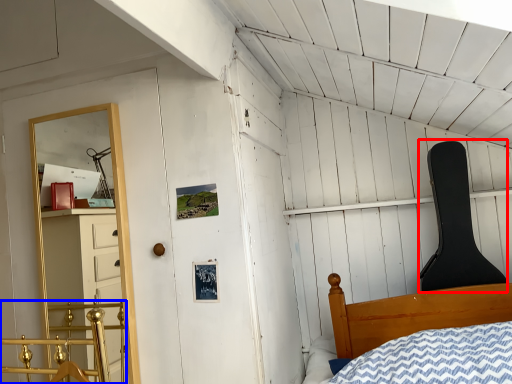
Question: Among these objects, which one is farthest to the camera, chair (highlighted by a red box) or rail (highlighted by a blue box)?

Choices:
 (A) chair
 (B) rail

Answer: (A)